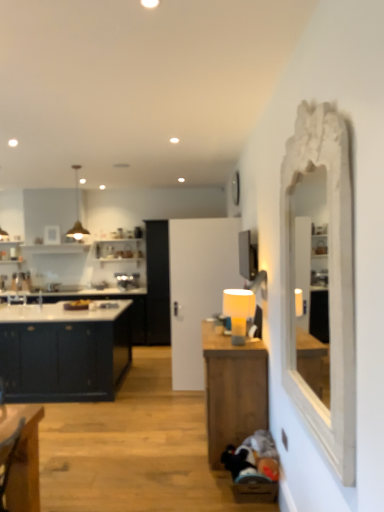
What do you see at coordinates (77, 213) in the screenshot? I see `metallic pendant light at upper left` at bounding box center [77, 213].

Image resolution: width=384 pixels, height=512 pixels. I want to click on wooden table at center, so click(233, 389).

What is the approximate height of wooden table at center?

The height of wooden table at center is 36.38 inches.

Measure the distance between matte yellow lampshade at center-right and camera.

The distance of matte yellow lampshade at center-right from camera is 10.56 feet.

The width and height of the screenshot is (384, 512). What are the coordinates of `metallic pendant light at upper left` in the screenshot? It's located at (77, 213).

Which is closer to the camera, (230, 314) or (344, 422)?

Clearly, point (230, 314) is more distant from the camera than point (344, 422).

Is matte yellow lampshade at center-right not close to white carved mirror at right?

Absolutely, matte yellow lampshade at center-right is distant from white carved mirror at right.

Considering the sizes of matte yellow lampshade at center-right and white carved mirror at right in the image, is matte yellow lampshade at center-right wider or thinner than white carved mirror at right?

Clearly, matte yellow lampshade at center-right has more width compared to white carved mirror at right.

Considering the positions of objects white carved mirror at right and metallic pendant light at upper left in the image provided, who is more to the left, white carved mirror at right or metallic pendant light at upper left?

Positioned to the left is metallic pendant light at upper left.

From the picture: Is white carved mirror at right bigger or smaller than metallic pendant light at upper left?

white carved mirror at right is bigger than metallic pendant light at upper left.

Is point (332, 410) positioned after point (74, 236)?

No, (332, 410) is closer to viewer.

From the image's perspective, does white carved mirror at right appear lower than metallic pendant light at upper left?

Yes, from the image's perspective, white carved mirror at right is beneath metallic pendant light at upper left.

Does wooden table at center have a lesser width compared to metallic pendant light at upper left?

In fact, wooden table at center might be wider than metallic pendant light at upper left.

Is wooden table at center completely or partially outside of metallic pendant light at upper left?

wooden table at center is positioned outside metallic pendant light at upper left.

Which object is closer to the camera, wooden table at center or metallic pendant light at upper left?

wooden table at center is in front.

Visually, is matte yellow lampshade at center-right positioned to the left or to the right of metallic pendant light at upper left?

matte yellow lampshade at center-right is positioned on metallic pendant light at upper left's right side.

From the picture: From a real-world perspective, does matte yellow lampshade at center-right stand above metallic pendant light at upper left?

No.

Are matte yellow lampshade at center-right and metallic pendant light at upper left located far from each other?

Absolutely, matte yellow lampshade at center-right is distant from metallic pendant light at upper left.

From the image's perspective, is matte dark blue cabinet at left over matte yellow lampshade at center-right?

No, from the image's perspective, matte dark blue cabinet at left is not over matte yellow lampshade at center-right.

Can you confirm if matte dark blue cabinet at left is thinner than matte yellow lampshade at center-right?

No, matte dark blue cabinet at left is not thinner than matte yellow lampshade at center-right.

From the picture: Considering the relative sizes of matte dark blue cabinet at left and matte yellow lampshade at center-right in the image provided, is matte dark blue cabinet at left taller than matte yellow lampshade at center-right?

Correct, matte dark blue cabinet at left is much taller as matte yellow lampshade at center-right.

Based on the photo, does matte dark blue cabinet at left turn towards matte yellow lampshade at center-right?

No, matte dark blue cabinet at left is not aimed at matte yellow lampshade at center-right.

Could you tell me if white carved mirror at right is turned towards matte dark blue cabinet at left?

No, white carved mirror at right is not aimed at matte dark blue cabinet at left.

Could matte dark blue cabinet at left be considered to be inside white carved mirror at right?

That's incorrect, matte dark blue cabinet at left is not inside white carved mirror at right.

What are the coordinates of `mirror that appears in front of the matte dark blue cabinet at left` in the screenshot? It's located at (320, 280).

From the image's perspective, which one is positioned lower, matte yellow lampshade at center-right or matte dark blue cabinet at left?

matte dark blue cabinet at left, from the image's perspective.

In the scene shown: Can you confirm if matte yellow lampshade at center-right is taller than matte dark blue cabinet at left?

In fact, matte yellow lampshade at center-right may be shorter than matte dark blue cabinet at left.

In order to click on lamp that is behind the white carved mirror at right in this screenshot , I will do `click(238, 311)`.

What are the coordinates of `mirror lying below the metallic pendant light at upper left (from the image's perspective)` in the screenshot? It's located at tap(320, 280).

Based on their spatial positions, is white carved mirror at right or metallic pendant light at upper left closer to matte yellow lampshade at center-right?

Based on the image, white carved mirror at right appears to be nearer to matte yellow lampshade at center-right.

Estimate the real-world distances between objects in this image. Which object is closer to matte dark blue cabinet at left, wooden table at center or matte yellow lampshade at center-right?

wooden table at center lies closer to matte dark blue cabinet at left than the other object.

Looking at the image, which one is located further to wooden table at center, matte dark blue cabinet at left or white carved mirror at right?

Among the two, matte dark blue cabinet at left is located further to wooden table at center.

From the image, which object appears to be nearer to matte dark blue cabinet at left, white carved mirror at right or metallic pendant light at upper left?

metallic pendant light at upper left is closer to matte dark blue cabinet at left.

When comparing their distances from white carved mirror at right, does matte yellow lampshade at center-right or metallic pendant light at upper left seem further?

metallic pendant light at upper left is positioned further to the anchor white carved mirror at right.

Looking at the image, which one is located further to wooden table at center, matte dark blue cabinet at left or metallic pendant light at upper left?

metallic pendant light at upper left is positioned further to the anchor wooden table at center.

Considering their positions, is metallic pendant light at upper left positioned closer to matte dark blue cabinet at left than wooden table at center?

wooden table at center lies closer to matte dark blue cabinet at left than the other object.

Looking at the image, which one is located closer to matte yellow lampshade at center-right, wooden table at center or matte dark blue cabinet at left?

Among the two, wooden table at center is located nearer to matte yellow lampshade at center-right.

At what (x,y) coordinates should I click in order to perform the action: click on light fixture between matte dark blue cabinet at left and matte yellow lampshade at center-right from left to right. Please return your answer as a coordinate pair (x, y). The height and width of the screenshot is (512, 384). Looking at the image, I should click on (77, 213).

In order to click on table between white carved mirror at right and matte dark blue cabinet at left along the z-axis in this screenshot , I will do `click(233, 389)`.

Identify the location of lamp located between white carved mirror at right and matte dark blue cabinet at left in the depth direction. The width and height of the screenshot is (384, 512). (238, 311).

Where is `table situated between matte dark blue cabinet at left and matte yellow lampshade at center-right from left to right`? Image resolution: width=384 pixels, height=512 pixels. table situated between matte dark blue cabinet at left and matte yellow lampshade at center-right from left to right is located at coordinates (233, 389).